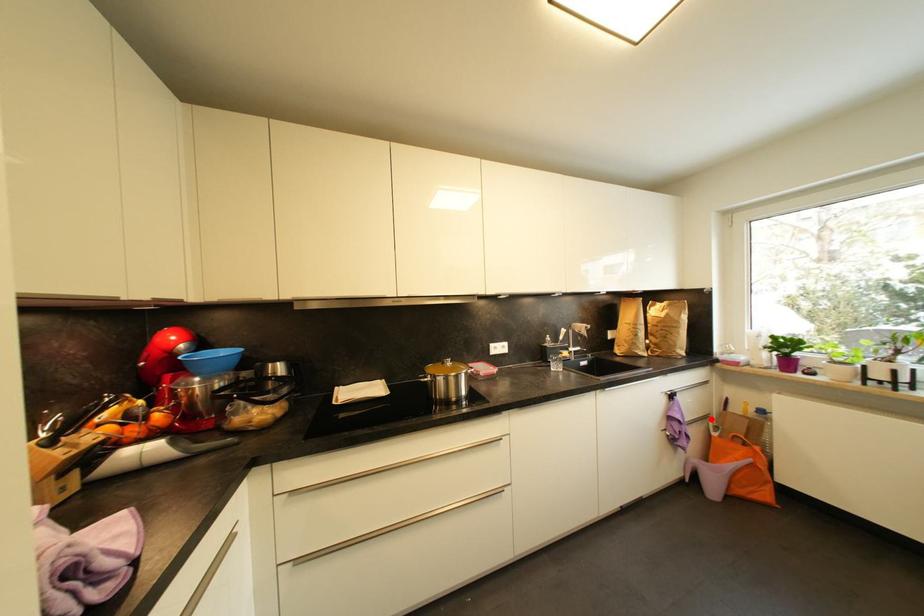
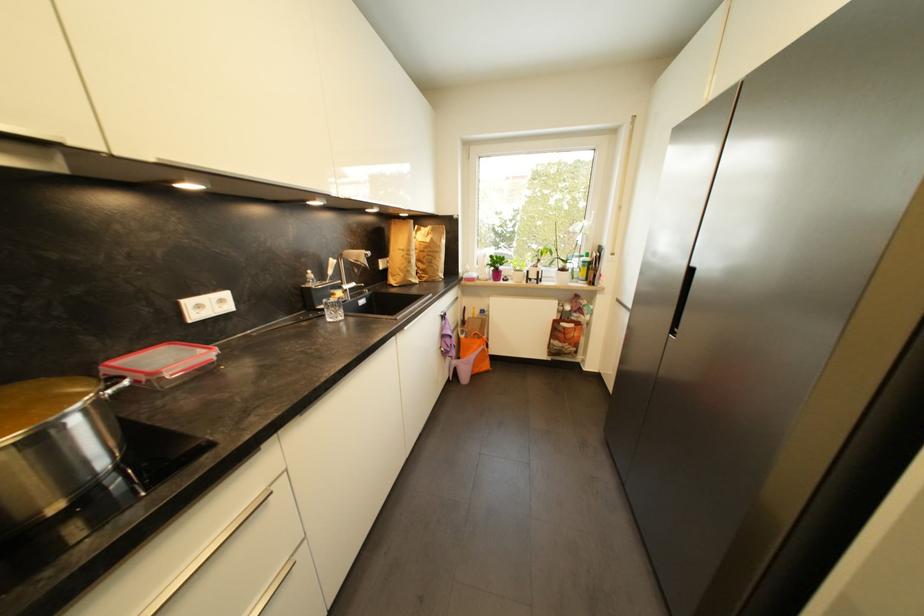
Question: I am providing you with two images of the same scene from different viewpoints. In image1, a red point is highlighted. Considering the same 3D point in image2, which of the following is correct?

Choices:
 (A) It is closer
 (B) It is farther

Answer: (A)